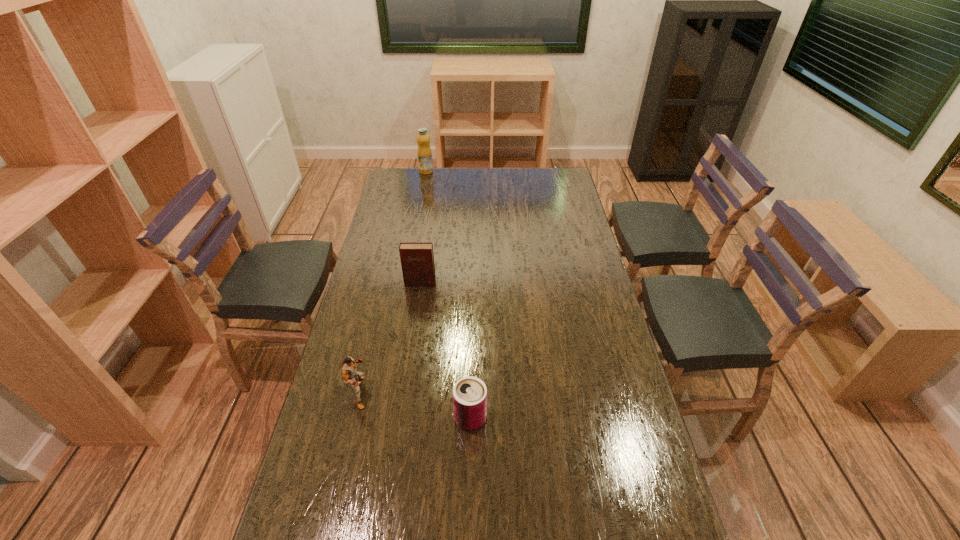
I want to click on fruit juice at the left edge, so click(x=424, y=152).

Identify the location of puncher that is at the left edge. This screenshot has width=960, height=540. (348, 367).

Identify the location of object that is at the far left corner. (424, 152).

Where is `vacant point at the far edge`? The width and height of the screenshot is (960, 540). vacant point at the far edge is located at coordinates (502, 186).

At what (x,y) coordinates should I click in order to perform the action: click on vacant space at the left edge of the desktop. Please return your answer as a coordinate pair (x, y). Looking at the image, I should click on (395, 205).

Identify the location of free region at the right edge. (571, 238).

The height and width of the screenshot is (540, 960). I want to click on vacant point at the far right corner, so pyautogui.click(x=538, y=181).

Find the location of a particular element. The image size is (960, 540). unoccupied area between the second farthest object and the puncher is located at coordinates (390, 338).

Find the location of `free area in between the third nearest object and the farthest object`. free area in between the third nearest object and the farthest object is located at coordinates (423, 227).

Locate an element on the screen. The image size is (960, 540). vacant area that lies between the can and the farthest object is located at coordinates (448, 295).